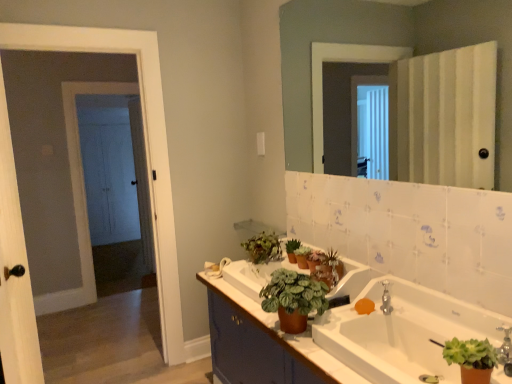
Question: Is orange matte soap at sink closer to camera compared to green matte plant at center?

Choices:
 (A) no
 (B) yes

Answer: (B)

Question: Does orange matte soap at sink have a lesser height compared to green matte plant at center?

Choices:
 (A) no
 (B) yes

Answer: (B)

Question: Is the surface of orange matte soap at sink in direct contact with green matte plant at center?

Choices:
 (A) yes
 (B) no

Answer: (B)

Question: Is there a large distance between orange matte soap at sink and green matte plant at center?

Choices:
 (A) no
 (B) yes

Answer: (A)

Question: Is green matte plant at center completely or partially inside orange matte soap at sink?

Choices:
 (A) no
 (B) yes

Answer: (A)

Question: From the image's perspective, relative to white matte towel bar at center, is green matte plant at center above or below?

Choices:
 (A) above
 (B) below

Answer: (A)

Question: Considering the positions of green matte plant at center and white matte towel bar at center in the image, is green matte plant at center taller or shorter than white matte towel bar at center?

Choices:
 (A) tall
 (B) short

Answer: (A)

Question: Considering the positions of point (297, 248) and point (222, 266), is point (297, 248) closer or farther from the camera than point (222, 266)?

Choices:
 (A) farther
 (B) closer

Answer: (A)

Question: Choose the correct answer: Is green matte plant at center inside white matte towel bar at center or outside it?

Choices:
 (A) inside
 (B) outside

Answer: (B)

Question: From a real-world perspective, is green matte houseplant at center, the third houseplant viewed from the back, above or below brown matte cabinet at lower center?

Choices:
 (A) above
 (B) below

Answer: (A)

Question: In terms of height, does green matte houseplant at center, the second houseplant viewed from the left, look taller or shorter compared to brown matte cabinet at lower center?

Choices:
 (A) tall
 (B) short

Answer: (B)

Question: Considering the relative positions of green matte houseplant at center, which ranks as the second houseplant in front-to-back order, and brown matte cabinet at lower center in the image provided, is green matte houseplant at center, which ranks as the second houseplant in front-to-back order, to the left or to the right of brown matte cabinet at lower center?

Choices:
 (A) right
 (B) left

Answer: (B)

Question: Considering the positions of green matte houseplant at center, the third houseplant viewed from the back, and brown matte cabinet at lower center in the image, is green matte houseplant at center, the third houseplant viewed from the back, wider or thinner than brown matte cabinet at lower center?

Choices:
 (A) wide
 (B) thin

Answer: (B)

Question: From their relative heights in the image, would you say brown matte cabinet at lower center is taller or shorter than green matte plant at center?

Choices:
 (A) short
 (B) tall

Answer: (B)

Question: From a real-world perspective, is brown matte cabinet at lower center positioned above or below green matte plant at center?

Choices:
 (A) above
 (B) below

Answer: (B)